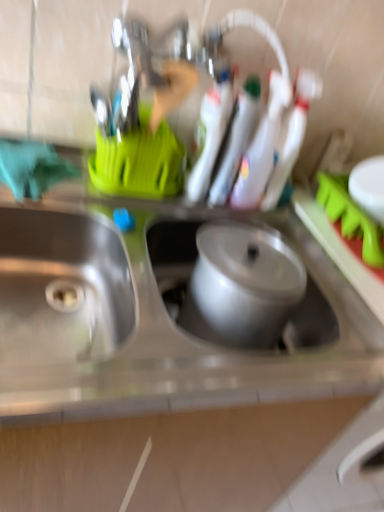
Locate an element on the screen. This screenshot has width=384, height=512. blank space situated above metallic silver pot at center, acting as the second sink starting from the left (from a real-world perspective) is located at coordinates (248, 253).